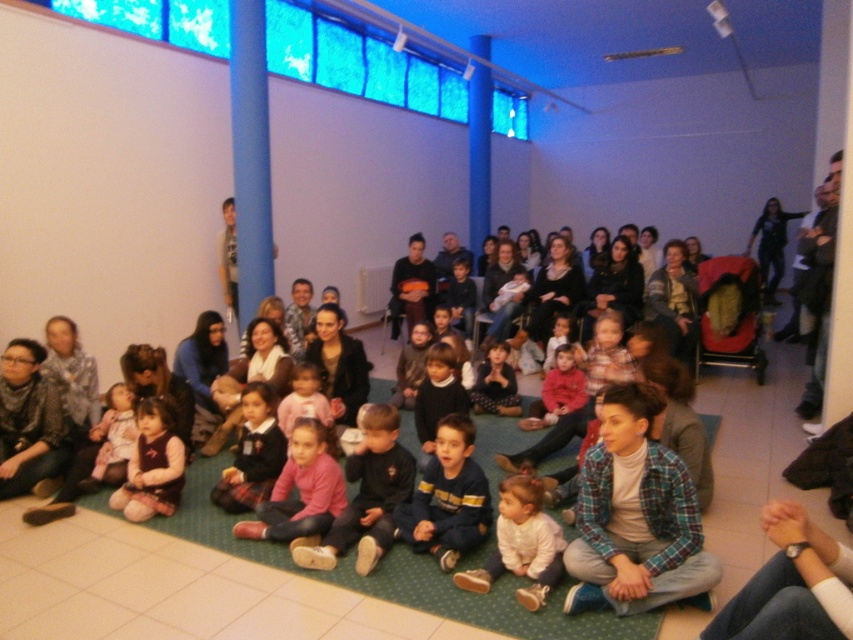
Which is behind, point (155, 509) or point (96, 470)?

Point (96, 470)

Does velvet maroon dress at lower left come in front of light pink fabric dress at lower left?

That is True.

Locate an element on the screen. velvet maroon dress at lower left is located at coordinates (152, 465).

Which is behind, point (352, 454) or point (527, 560)?

Point (352, 454)

Who is more distant from viewer, (387, 518) or (517, 532)?

The point (387, 518) is more distant.

Locate an element on the screen. pink fabric pants at lower center is located at coordinates (366, 497).

Which is above, pink fabric pants at lower center or matte pink sweater at center?

matte pink sweater at center

From the picture: Can you confirm if pink fabric pants at lower center is positioned below matte pink sweater at center?

Yes.

You are a GUI agent. You are given a task and a screenshot of the screen. Output one action in this format:
    pyautogui.click(x=<x>, y=<y>)
    Task: Click on the pink fabric pants at lower center
    This screenshot has width=853, height=640.
    Given the screenshot: What is the action you would take?
    pyautogui.click(x=366, y=497)